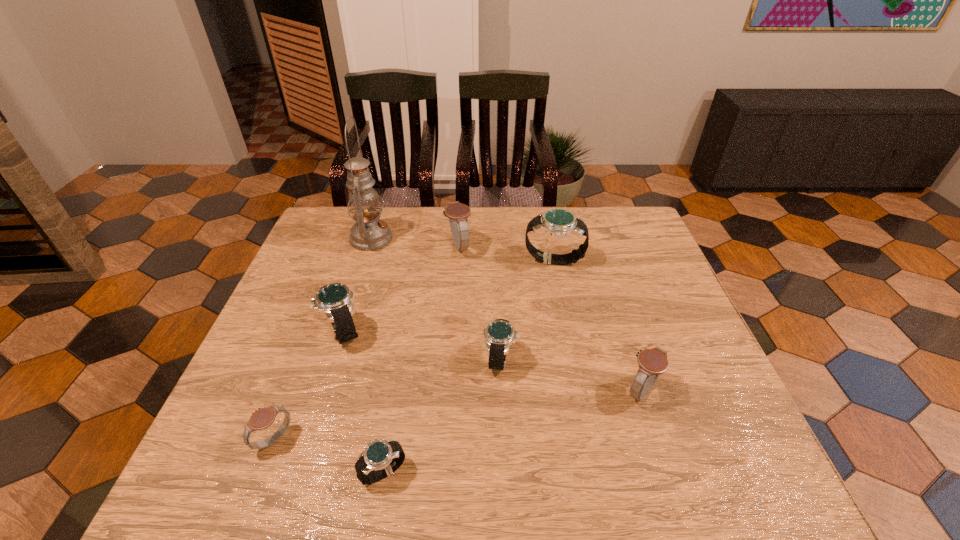
Select which gray watch appears as the closest to the farthest silver watch. Please provide its 2D coordinates. Your answer should be formatted as a tuple, i.e. [(x, y)], where the tuple contains the x and y coordinates of a point satisfying the conditions above.

[(458, 213)]

Image resolution: width=960 pixels, height=540 pixels. Find the location of `vacant area in the image that satisfies the following two spatial constraints: 1. on the back side of the second biggest silver watch; 2. on the right side of the second gray watch from right to left`. vacant area in the image that satisfies the following two spatial constraints: 1. on the back side of the second biggest silver watch; 2. on the right side of the second gray watch from right to left is located at coordinates (370, 246).

In order to click on free location that satisfies the following two spatial constraints: 1. on the front side of the leftmost gray watch; 2. on the right side of the nearest silver watch in this screenshot , I will do click(262, 472).

Locate an element on the screen. free location that satisfies the following two spatial constraints: 1. on the back side of the farthest gray watch; 2. on the right side of the smallest gray watch is located at coordinates (348, 246).